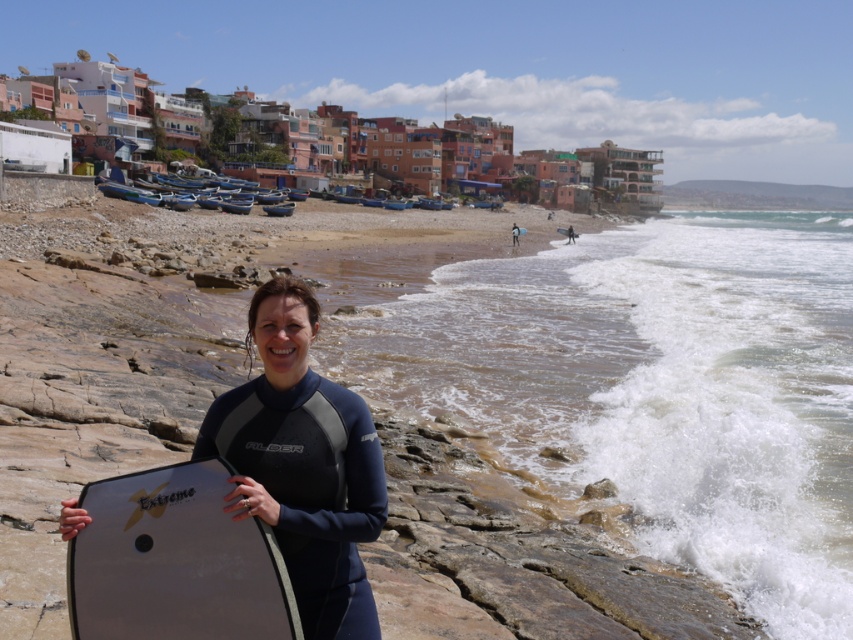
You are a photographer trying to capture the white frothy water at lower right and the white foam surfboard at lower right. Since both are at the lower right, which one is positioned more to the right?

The white frothy water at lower right is positioned more to the right than the white foam surfboard at lower right.

You are a photographer trying to capture the white frothy water at lower right and the white foam surfboard at lower right. Which object is wider in the image?

The white frothy water at lower right is wider than the white foam surfboard at lower right.